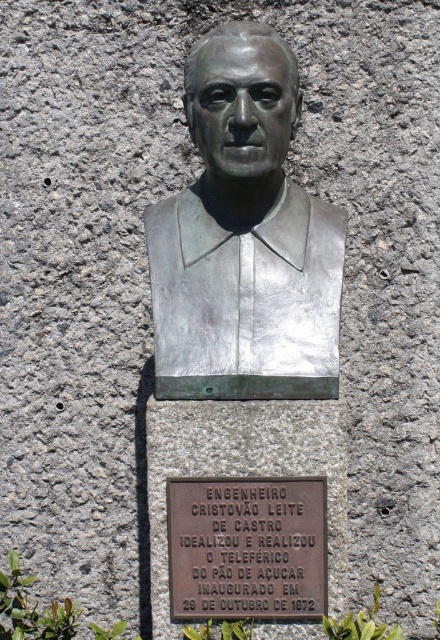
Is point (184, 196) positioned in front of point (173, 576)?

No, (184, 196) is further to viewer.

What are the coordinates of `bronze bust at center` in the screenshot? It's located at (245, 237).